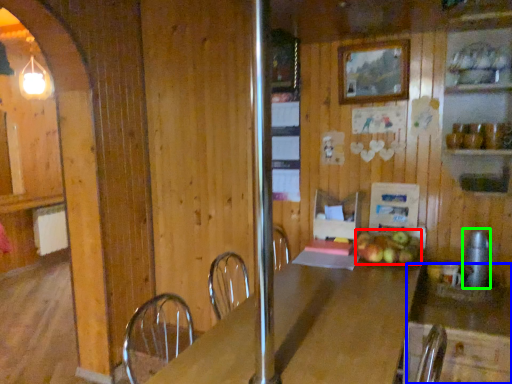
Question: Which is farther away from apple (highlighted by a red box)? counter (highlighted by a blue box) or appliance (highlighted by a green box)?

Choices:
 (A) counter
 (B) appliance

Answer: (B)